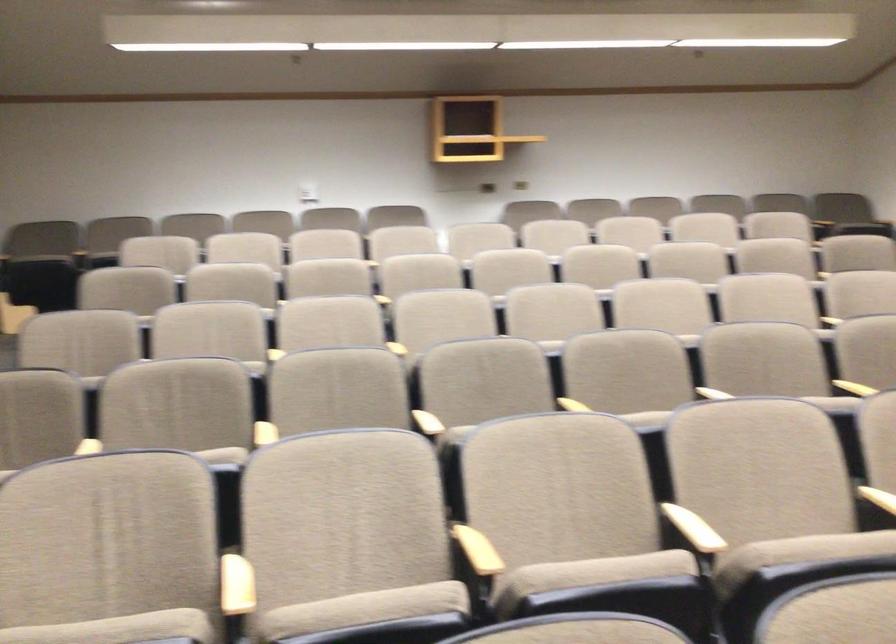
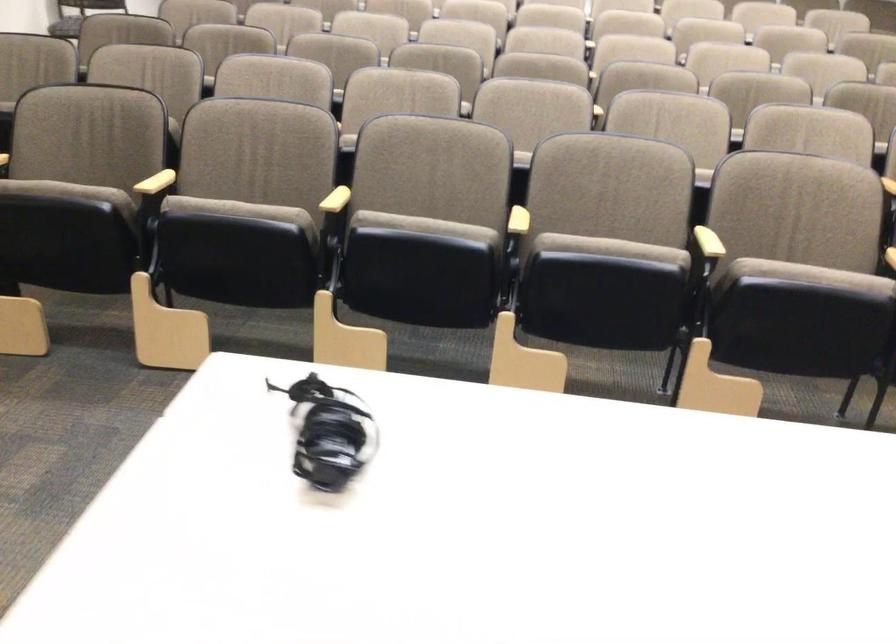
Which direction would the cameraman need to move to produce the second image?

The cameraman walked toward right, backward.